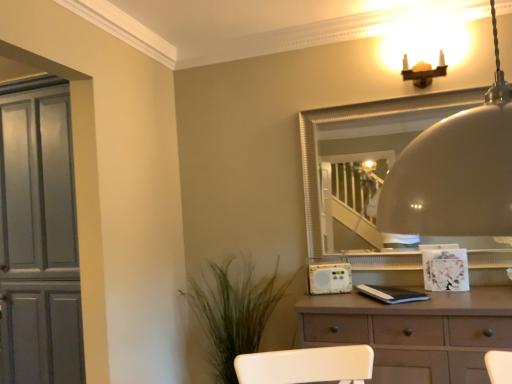
Question: Can you confirm if green leafy plant at lower left is thinner than white plastic radio at center?

Choices:
 (A) no
 (B) yes

Answer: (A)

Question: Is green leafy plant at lower left to the right of white plastic radio at center from the viewer's perspective?

Choices:
 (A) no
 (B) yes

Answer: (A)

Question: Is green leafy plant at lower left completely or partially outside of white plastic radio at center?

Choices:
 (A) yes
 (B) no

Answer: (A)

Question: Is green leafy plant at lower left at the left side of white plastic radio at center?

Choices:
 (A) no
 (B) yes

Answer: (B)

Question: Is white plastic radio at center at the back of green leafy plant at lower left?

Choices:
 (A) yes
 (B) no

Answer: (B)

Question: Is green leafy plant at lower left wider than white plastic radio at center?

Choices:
 (A) no
 (B) yes

Answer: (B)

Question: Considering the relative sizes of silver textured mirror at upper center and white plastic radio at center in the image provided, is silver textured mirror at upper center wider than white plastic radio at center?

Choices:
 (A) yes
 (B) no

Answer: (B)

Question: Considering the relative sizes of silver textured mirror at upper center and white plastic radio at center in the image provided, is silver textured mirror at upper center smaller than white plastic radio at center?

Choices:
 (A) yes
 (B) no

Answer: (B)

Question: Is silver textured mirror at upper center closer to camera compared to white plastic radio at center?

Choices:
 (A) yes
 (B) no

Answer: (A)

Question: Is silver textured mirror at upper center oriented towards white plastic radio at center?

Choices:
 (A) yes
 (B) no

Answer: (A)

Question: Considering the relative positions of silver textured mirror at upper center and white plastic radio at center in the image provided, is silver textured mirror at upper center to the left of white plastic radio at center from the viewer's perspective?

Choices:
 (A) no
 (B) yes

Answer: (A)

Question: Does silver textured mirror at upper center appear on the right side of white plastic radio at center?

Choices:
 (A) no
 (B) yes

Answer: (B)

Question: Would you consider matte gray cabinet at left to be distant from brown matte chest of drawers at center?

Choices:
 (A) no
 (B) yes

Answer: (B)